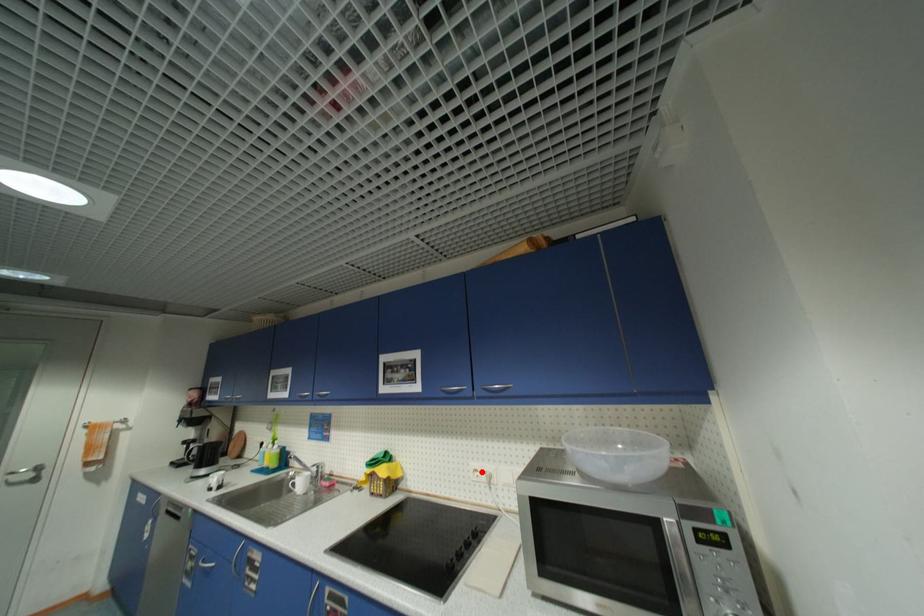
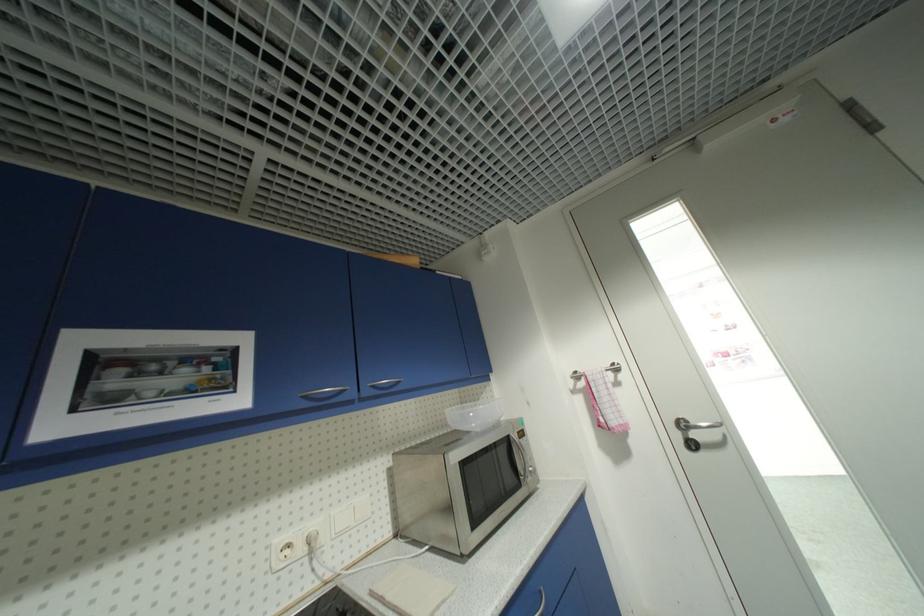
Find the pixel in the second image that matches the highlighted location in the first image.

(294, 546)